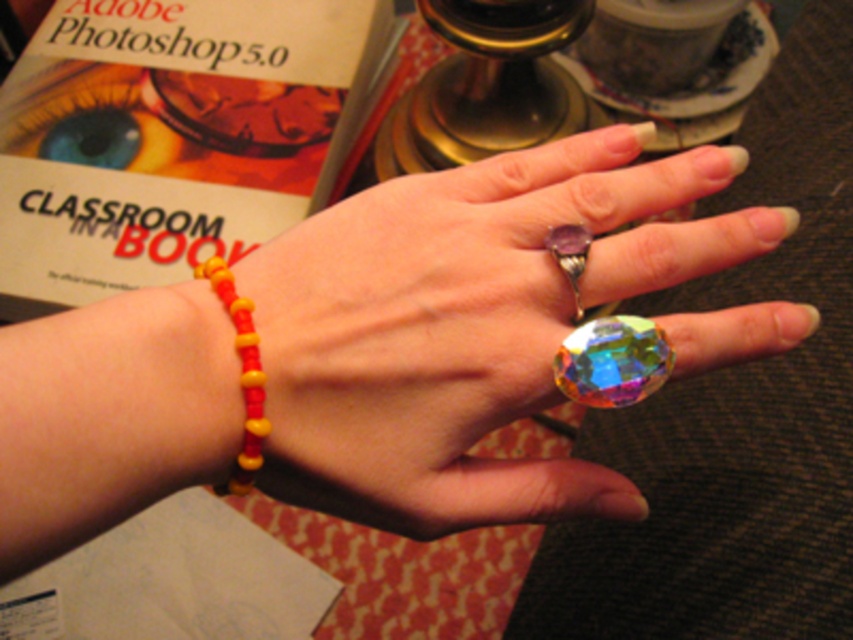
Question: Which object appears farthest from the camera in this image?

Choices:
 (A) multicolored glass ring at center
 (B) rainbow faceted glass bead at center
 (C) purple gemstone ring at center

Answer: (C)

Question: From the image, what is the correct spatial relationship of multicolored glass ring at center in relation to rainbow faceted glass bead at center?

Choices:
 (A) right
 (B) left

Answer: (B)

Question: Which point appears closest to the camera in this image?

Choices:
 (A) (578, 234)
 (B) (242, 323)
 (C) (654, 340)
 (D) (608, 209)

Answer: (B)

Question: Estimate the real-world distances between objects in this image. Which object is farther from the purple gemstone ring at center?

Choices:
 (A) rainbow faceted glass bead at center
 (B) yellow matte beads at lower left
 (C) multicolored glass ring at center

Answer: (B)

Question: In this image, where is multicolored glass ring at center located relative to rainbow faceted glass bead at center?

Choices:
 (A) below
 (B) above

Answer: (B)

Question: Does multicolored glass ring at center appear on the left side of rainbow faceted glass bead at center?

Choices:
 (A) no
 (B) yes

Answer: (B)